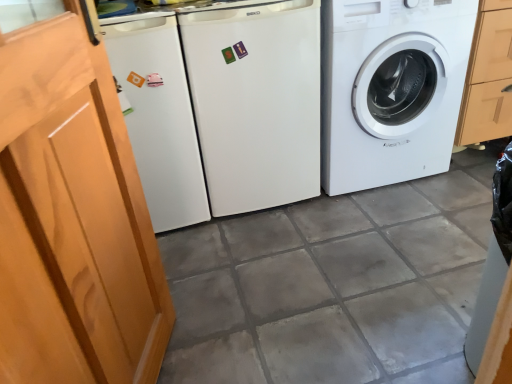
Question: Can you confirm if wooden screen door at left is positioned to the left of white glossy washing machine at right, placed as the 2th washing machine when sorted from left to right?

Choices:
 (A) no
 (B) yes

Answer: (B)

Question: Does wooden screen door at left turn towards white glossy washing machine at right, placed as the 2th washing machine when sorted from left to right?

Choices:
 (A) no
 (B) yes

Answer: (A)

Question: Is wooden screen door at left positioned behind white glossy washing machine at right, placed as the 2th washing machine when sorted from left to right?

Choices:
 (A) no
 (B) yes

Answer: (A)

Question: Is wooden screen door at left not within white glossy washing machine at right, placed as the 2th washing machine when sorted from left to right?

Choices:
 (A) yes
 (B) no

Answer: (A)

Question: Does wooden screen door at left appear on the right side of white glossy washing machine at right, placed as the 2th washing machine when sorted from left to right?

Choices:
 (A) no
 (B) yes

Answer: (A)

Question: Can you see wooden screen door at left touching white glossy washing machine at right, placed as the 2th washing machine when sorted from left to right?

Choices:
 (A) yes
 (B) no

Answer: (B)

Question: Considering the relative sizes of white matte refrigerator at center, the second washing machine positioned from the right, and wooden screen door at left in the image provided, is white matte refrigerator at center, the second washing machine positioned from the right, shorter than wooden screen door at left?

Choices:
 (A) yes
 (B) no

Answer: (A)

Question: Is white matte refrigerator at center, the second washing machine positioned from the right, in front of wooden screen door at left?

Choices:
 (A) no
 (B) yes

Answer: (A)

Question: Could wooden screen door at left be considered to be inside white matte refrigerator at center, the first washing machine viewed from the left?

Choices:
 (A) no
 (B) yes

Answer: (A)

Question: From a real-world perspective, is white matte refrigerator at center, the second washing machine positioned from the right, physically below wooden screen door at left?

Choices:
 (A) no
 (B) yes

Answer: (B)

Question: Considering the relative sizes of white matte refrigerator at center, the first washing machine viewed from the left, and wooden screen door at left in the image provided, is white matte refrigerator at center, the first washing machine viewed from the left, bigger than wooden screen door at left?

Choices:
 (A) no
 (B) yes

Answer: (B)

Question: From the image's perspective, is white matte refrigerator at center, the first washing machine viewed from the left, beneath wooden screen door at left?

Choices:
 (A) yes
 (B) no

Answer: (B)

Question: Can you confirm if white glossy washing machine at right, placed as the 2th washing machine when sorted from left to right, is wider than wooden screen door at left?

Choices:
 (A) no
 (B) yes

Answer: (B)